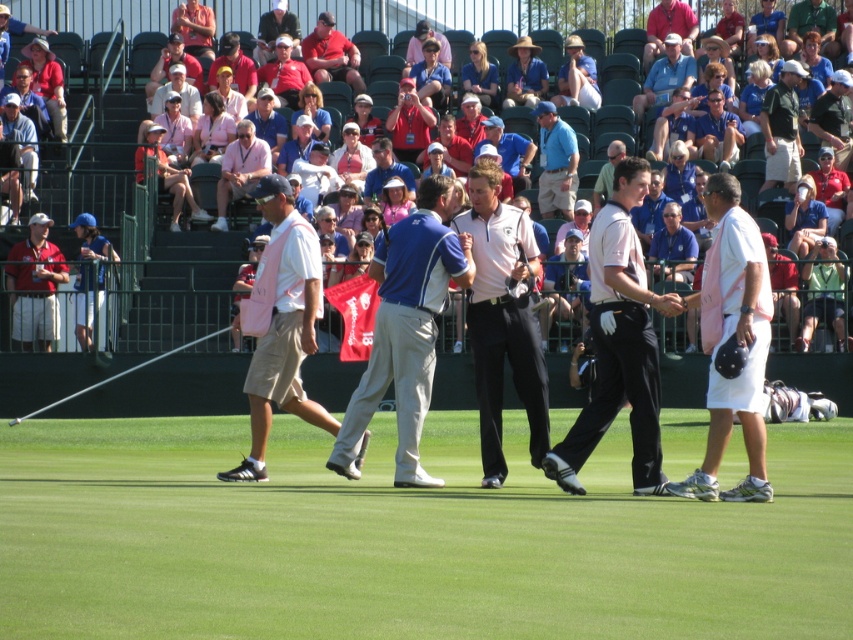
Question: Does light pink smooth shirt at center appear over pink fabric bag at center?

Choices:
 (A) yes
 (B) no

Answer: (A)

Question: Can you confirm if matte pink shirt at left is positioned below light blue shirt at center?

Choices:
 (A) yes
 (B) no

Answer: (A)

Question: Which of these objects is positioned closest to the light blue shirt at center?

Choices:
 (A) matte blue shirt at center
 (B) matte pink polo shirt at center
 (C) matte red shirt at center

Answer: (B)

Question: Is the position of matte blue shirt at center more distant than that of metallic silver golf club at center?

Choices:
 (A) yes
 (B) no

Answer: (A)

Question: Which object is positioned farthest from the white cotton shirt at center?

Choices:
 (A) matte red shirt at center
 (B) white cotton polo shirt at center
 (C) matte pink shirt at left
 (D) metallic silver golf club at center

Answer: (B)

Question: Considering the real-world distances, which object is closest to the pink fabric shirt at center?

Choices:
 (A) matte pink polo shirt at center
 (B) matte white shirt at center
 (C) blue fabric shirt at center

Answer: (A)